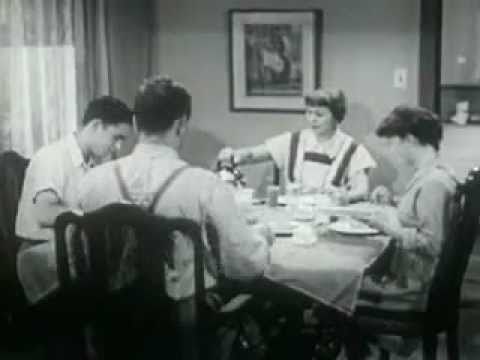
The width and height of the screenshot is (480, 360). I want to click on tablecloth, so click(x=327, y=266), click(x=347, y=301), click(x=363, y=243).